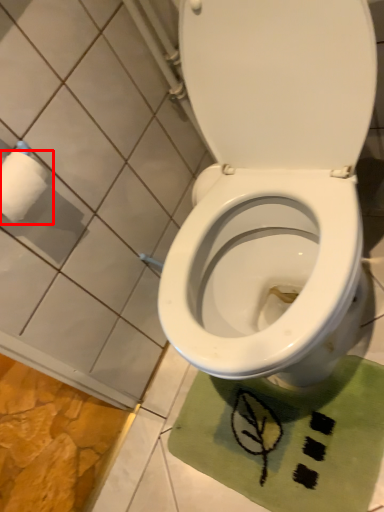
Question: In this image, where is toilet paper (annotated by the red box) located relative to bath mat?

Choices:
 (A) left
 (B) right

Answer: (A)